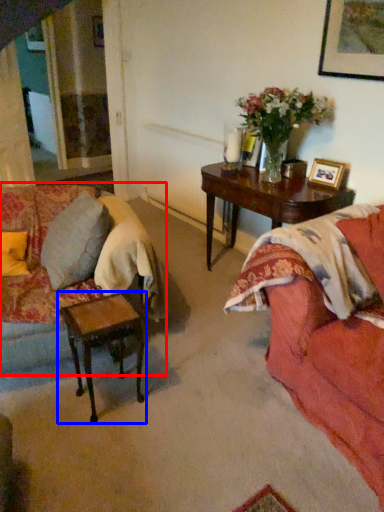
Question: Among these objects, which one is nearest to the camera, studio couch (highlighted by a red box) or table (highlighted by a blue box)?

Choices:
 (A) studio couch
 (B) table

Answer: (A)